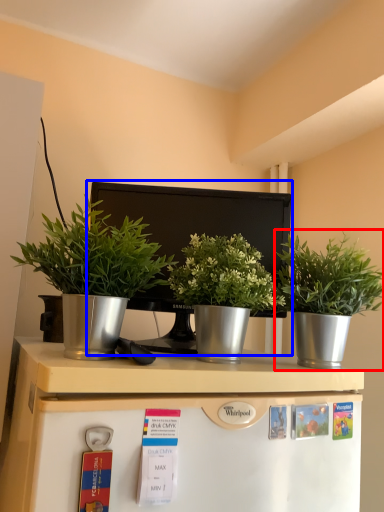
Question: Which object appears farthest to the camera in this image, houseplant (highlighted by a red box) or appliance (highlighted by a blue box)?

Choices:
 (A) houseplant
 (B) appliance

Answer: (B)